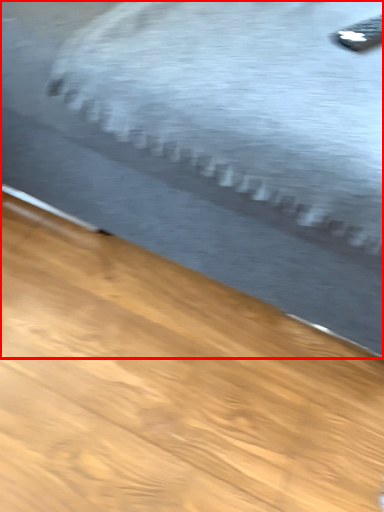
Question: From the image, what is the correct spatial relationship of bed (annotated by the red box) in relation to remote?

Choices:
 (A) left
 (B) right

Answer: (A)